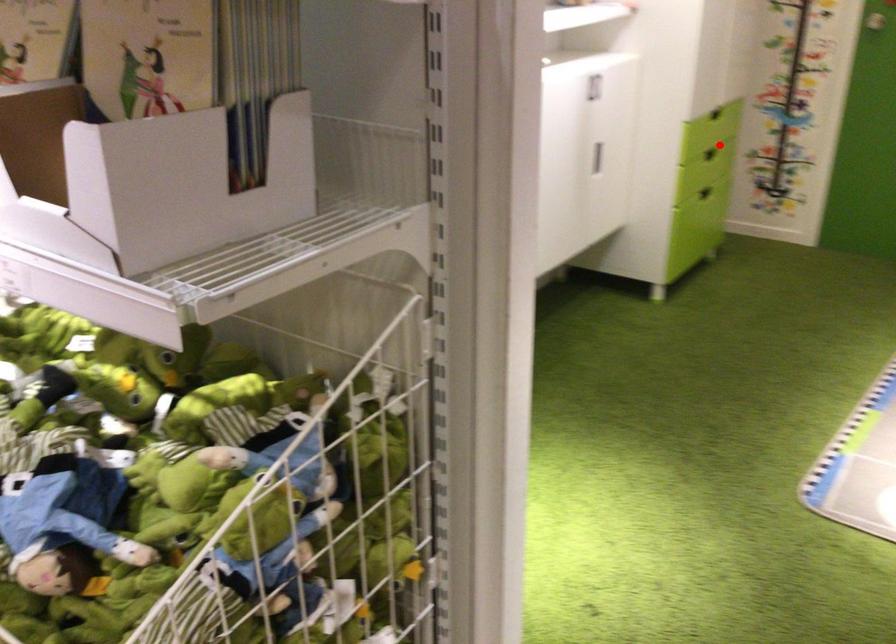
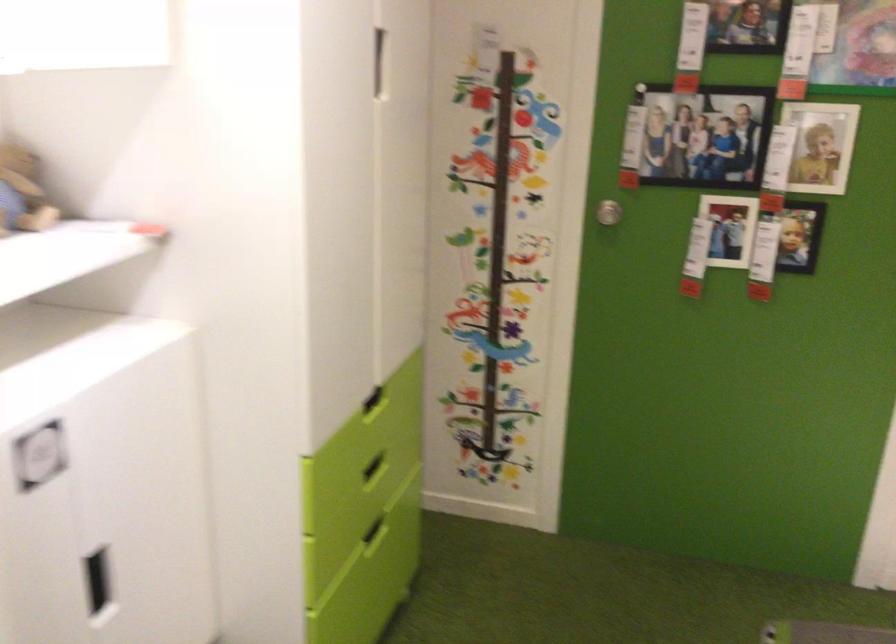
Question: I am providing you with two images of the same scene from different viewpoints. A red point is marked on the first image. Can you still see the location of the red point in image 2?

Choices:
 (A) Yes
 (B) No

Answer: (A)